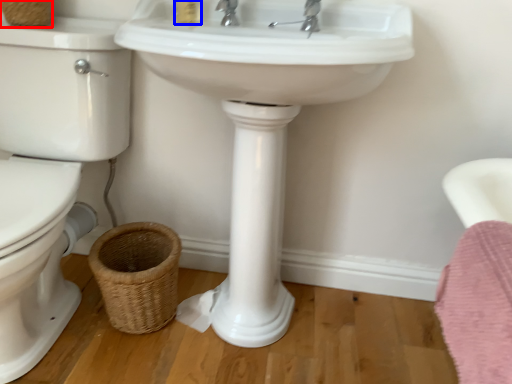
Question: Which point is further to the camera, basket (highlighted by a red box) or toiletry (highlighted by a blue box)?

Choices:
 (A) basket
 (B) toiletry

Answer: (A)